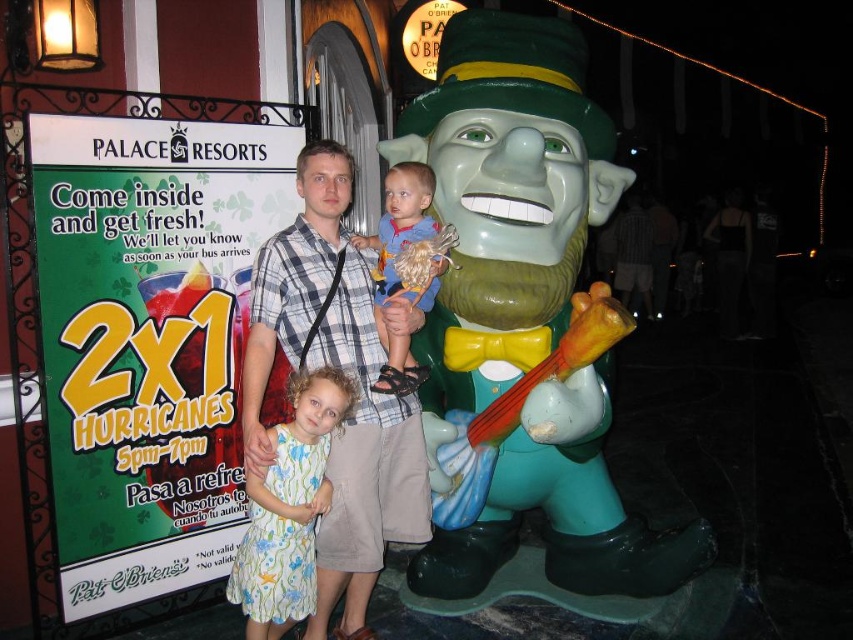
You are a photographer trying to frame a shot of the plaid shirt at center and the floral cotton dress at center. Which one should you focus on first if you want to capture the tallest object in the frame?

The plaid shirt at center is taller than the floral cotton dress at center, so you should focus on the plaid shirt at center first to capture the tallest object in the frame.

You are a photographer trying to capture a photo of the green painted statue at right and the blue cotton shirt at center. Since you want both subjects to be in focus, you need to know which one is closer to you. Can you determine which is closer?

The green painted statue at right is in front of the blue cotton shirt at center, so the green painted statue at right is closer to you.